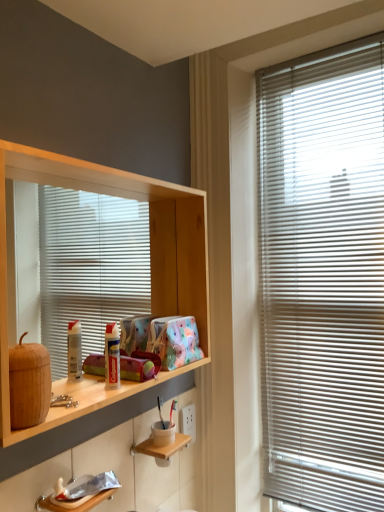
Where is `wooden shelf at left, arranged as the 2th shelf when ordered from the bottom`? Image resolution: width=384 pixels, height=512 pixels. wooden shelf at left, arranged as the 2th shelf when ordered from the bottom is located at coordinates (151, 264).

What is the approximate height of wooden shelf at left, arranged as the first shelf when viewed from the top?

The height of wooden shelf at left, arranged as the first shelf when viewed from the top, is 64.22 centimeters.

What do you see at coordinates (161, 447) in the screenshot? I see `wooden shelf at lower center, positioned as the first shelf in bottom-to-top order` at bounding box center [161, 447].

The width and height of the screenshot is (384, 512). What are the coordinates of `wooden shelf at left, arranged as the 2th shelf when ordered from the bottom` in the screenshot? It's located at (151, 264).

Which of these two, wooden shelf at lower center, which ranks as the 2th shelf in top-to-bottom order, or white plastic blinds at right, stands taller?

Standing taller between the two is white plastic blinds at right.

Between wooden shelf at lower center, which ranks as the 2th shelf in top-to-bottom order, and white plastic blinds at right, which one has larger size?

white plastic blinds at right is bigger.

From a real-world perspective, which is physically above, wooden shelf at lower center, which ranks as the 2th shelf in top-to-bottom order, or white plastic blinds at right?

In real-world perspective, white plastic blinds at right is above.

Is wooden shelf at lower center, positioned as the first shelf in bottom-to-top order, wider or thinner than white plastic blinds at right?

In the image, wooden shelf at lower center, positioned as the first shelf in bottom-to-top order, appears to be wider than white plastic blinds at right.

Does point (99, 166) lie in front of point (189, 438)?

Yes, point (99, 166) is closer to viewer.

From the picture: From the image's perspective, is wooden shelf at left, arranged as the 2th shelf when ordered from the bottom, located above or below wooden shelf at lower center, positioned as the first shelf in bottom-to-top order?

wooden shelf at left, arranged as the 2th shelf when ordered from the bottom, is above wooden shelf at lower center, positioned as the first shelf in bottom-to-top order.

From a real-world perspective, relative to wooden shelf at lower center, which ranks as the 2th shelf in top-to-bottom order, is wooden shelf at left, arranged as the 2th shelf when ordered from the bottom, vertically above or below?

wooden shelf at left, arranged as the 2th shelf when ordered from the bottom, is above wooden shelf at lower center, which ranks as the 2th shelf in top-to-bottom order.

Can you confirm if white plastic blinds at right is positioned to the left of wooden shelf at left, arranged as the 2th shelf when ordered from the bottom?

Incorrect, white plastic blinds at right is not on the left side of wooden shelf at left, arranged as the 2th shelf when ordered from the bottom.

Is point (345, 468) less distant than point (176, 199)?

Yes, point (345, 468) is closer to viewer.

Is wooden shelf at left, arranged as the 2th shelf when ordered from the bottom, located outside white plastic blinds at right?

Indeed, wooden shelf at left, arranged as the 2th shelf when ordered from the bottom, is completely outside white plastic blinds at right.

Between wooden shelf at left, arranged as the first shelf when viewed from the top, and white plastic blinds at right, which one has more height?

Standing taller between the two is white plastic blinds at right.

Is wooden shelf at left, arranged as the 2th shelf when ordered from the bottom, in contact with white plastic blinds at right?

There is a gap between wooden shelf at left, arranged as the 2th shelf when ordered from the bottom, and white plastic blinds at right.

Does point (171, 237) lie behind point (268, 340)?

No, it is in front of (268, 340).

Does wooden shelf at lower center, positioned as the first shelf in bottom-to-top order, appear on the right side of wooden shelf at left, arranged as the 2th shelf when ordered from the bottom?

Yes.

Looking at this image, which point is more distant from viewer, (143,453) or (5,247)?

Point (143,453)

Can we say wooden shelf at lower center, which ranks as the 2th shelf in top-to-bottom order, lies outside wooden shelf at left, arranged as the first shelf when viewed from the top?

wooden shelf at lower center, which ranks as the 2th shelf in top-to-bottom order, is positioned outside wooden shelf at left, arranged as the first shelf when viewed from the top.

Does wooden shelf at lower center, which ranks as the 2th shelf in top-to-bottom order, have a larger size compared to wooden shelf at left, arranged as the first shelf when viewed from the top?

Incorrect, wooden shelf at lower center, which ranks as the 2th shelf in top-to-bottom order, is not larger than wooden shelf at left, arranged as the first shelf when viewed from the top.

You are a GUI agent. You are given a task and a screenshot of the screen. Output one action in this format:
    pyautogui.click(x=<x>, y=<y>)
    Task: Click on the window blind on the right of wooden shelf at lower center, positioned as the first shelf in bottom-to-top order
    This screenshot has width=384, height=512.
    Given the screenshot: What is the action you would take?
    pyautogui.click(x=322, y=276)

From a real-world perspective, is white plastic blinds at right physically below wooden shelf at lower center, positioned as the first shelf in bottom-to-top order?

No, from a real-world perspective, white plastic blinds at right is not beneath wooden shelf at lower center, positioned as the first shelf in bottom-to-top order.

Is white plastic blinds at right looking in the opposite direction of wooden shelf at lower center, positioned as the first shelf in bottom-to-top order?

No, wooden shelf at lower center, positioned as the first shelf in bottom-to-top order, is not at the back of white plastic blinds at right.

Which is in front, point (365, 221) or point (146, 450)?

The point (146, 450) is in front.

The height and width of the screenshot is (512, 384). I want to click on the 1st shelf in front of the white plastic blinds at right, so click(161, 447).

Locate an element on the screen. The image size is (384, 512). shelf that is behind the wooden shelf at left, arranged as the 2th shelf when ordered from the bottom is located at coordinates (161, 447).

In the scene shown: Estimate the real-world distances between objects in this image. Which object is further from white plastic blinds at right, wooden shelf at lower center, positioned as the first shelf in bottom-to-top order, or wooden shelf at left, arranged as the first shelf when viewed from the top?

wooden shelf at lower center, positioned as the first shelf in bottom-to-top order, is positioned further to the anchor white plastic blinds at right.

From the image, which object appears to be farther from wooden shelf at lower center, which ranks as the 2th shelf in top-to-bottom order, white plastic blinds at right or wooden shelf at left, arranged as the 2th shelf when ordered from the bottom?

white plastic blinds at right is positioned further to the anchor wooden shelf at lower center, which ranks as the 2th shelf in top-to-bottom order.

Consider the image. From the image, which object appears to be farther from wooden shelf at lower center, which ranks as the 2th shelf in top-to-bottom order, wooden shelf at left, arranged as the 2th shelf when ordered from the bottom, or white plastic blinds at right?

white plastic blinds at right is further to wooden shelf at lower center, which ranks as the 2th shelf in top-to-bottom order.

From the picture: From the image, which object appears to be nearer to wooden shelf at left, arranged as the 2th shelf when ordered from the bottom, wooden shelf at lower center, which ranks as the 2th shelf in top-to-bottom order, or white plastic blinds at right?

white plastic blinds at right.

When comparing their distances from white plastic blinds at right, does wooden shelf at left, arranged as the 2th shelf when ordered from the bottom, or wooden shelf at lower center, which ranks as the 2th shelf in top-to-bottom order, seem further?

wooden shelf at lower center, which ranks as the 2th shelf in top-to-bottom order.

Estimate the real-world distances between objects in this image. Which object is closer to wooden shelf at left, arranged as the 2th shelf when ordered from the bottom, white plastic blinds at right or wooden shelf at lower center, positioned as the first shelf in bottom-to-top order?

Among the two, white plastic blinds at right is located nearer to wooden shelf at left, arranged as the 2th shelf when ordered from the bottom.

Where is `shelf between wooden shelf at left, arranged as the 2th shelf when ordered from the bottom, and white plastic blinds at right`? The width and height of the screenshot is (384, 512). shelf between wooden shelf at left, arranged as the 2th shelf when ordered from the bottom, and white plastic blinds at right is located at coordinates (161, 447).